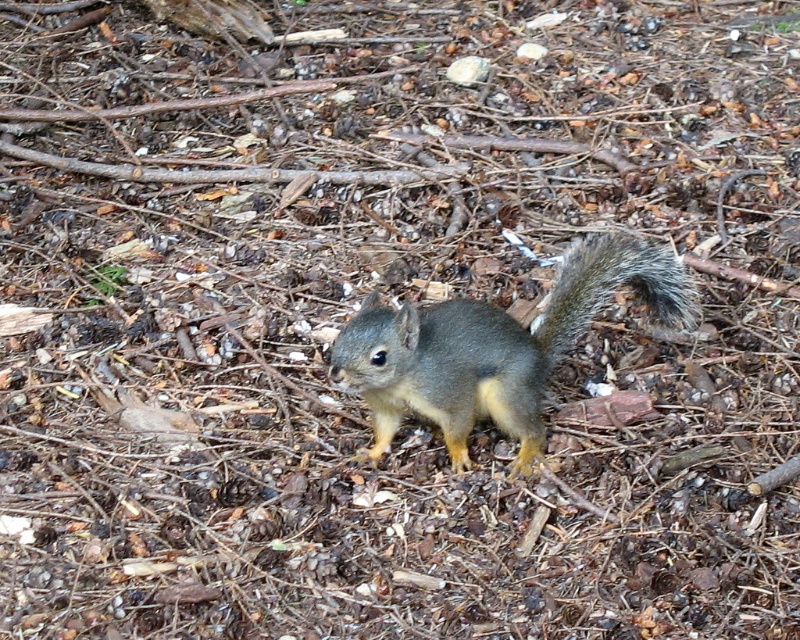
Question: Does shiny gray squirrel at center come behind fuzzy brown tail at center?

Choices:
 (A) no
 (B) yes

Answer: (A)

Question: In this image, where is shiny gray squirrel at center located relative to fuzzy brown tail at center?

Choices:
 (A) above
 (B) below

Answer: (B)

Question: From the image, what is the correct spatial relationship of shiny gray squirrel at center in relation to fuzzy brown tail at center?

Choices:
 (A) right
 (B) left

Answer: (B)